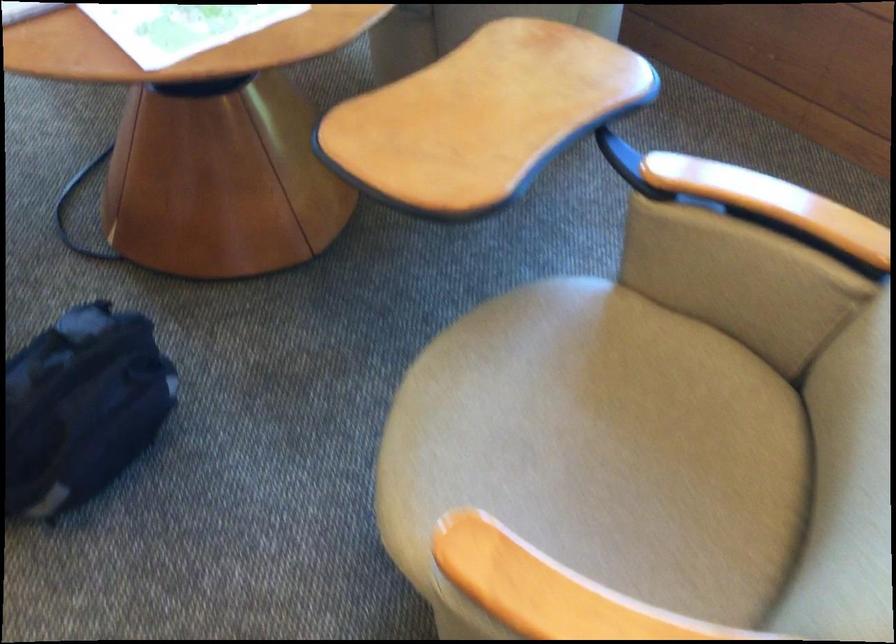
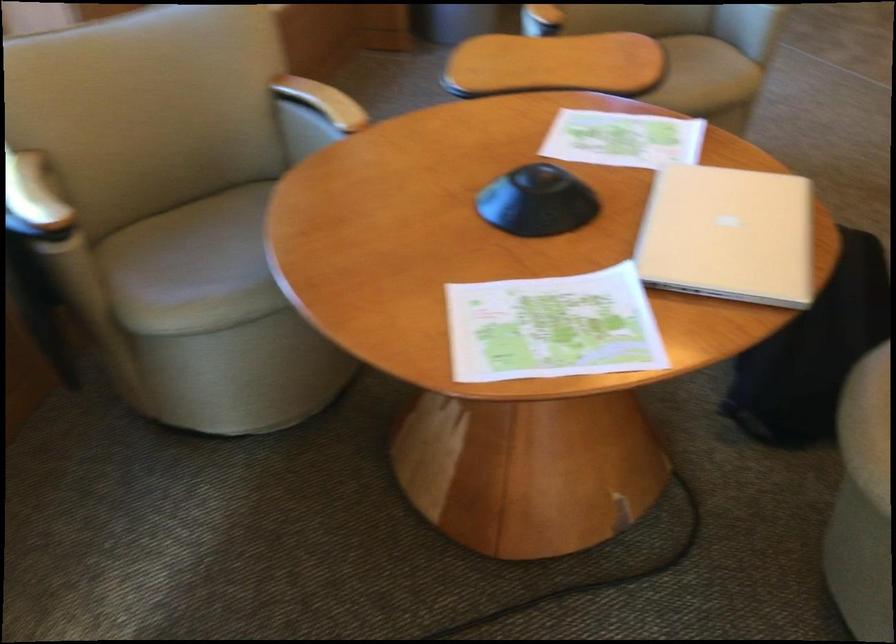
Question: I am providing you with two images of the same scene from different viewpoints. Which of the following objects are not visible in image2?

Choices:
 (A) metal canister lid
 (B) wooden chair armrest
 (C) black bag
 (D) black dome object

Answer: (C)